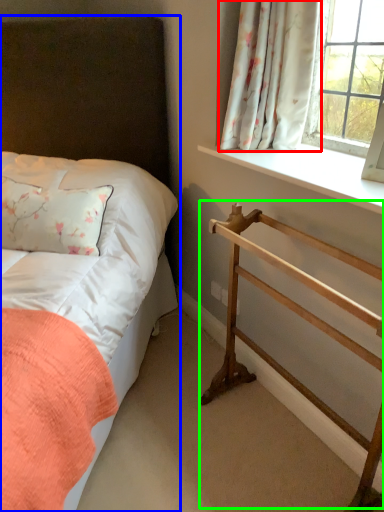
Question: Which object is positioned closest to curtain (highlighted by a red box)? Select from bed (highlighted by a blue box) and balustrade (highlighted by a green box).

Choices:
 (A) bed
 (B) balustrade

Answer: (B)